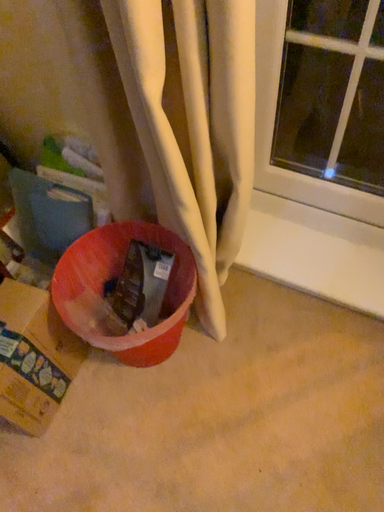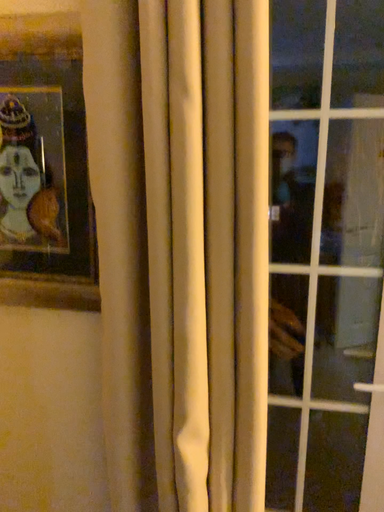
Question: Which way did the camera rotate in the video?

Choices:
 (A) rotated upward
 (B) rotated downward

Answer: (A)